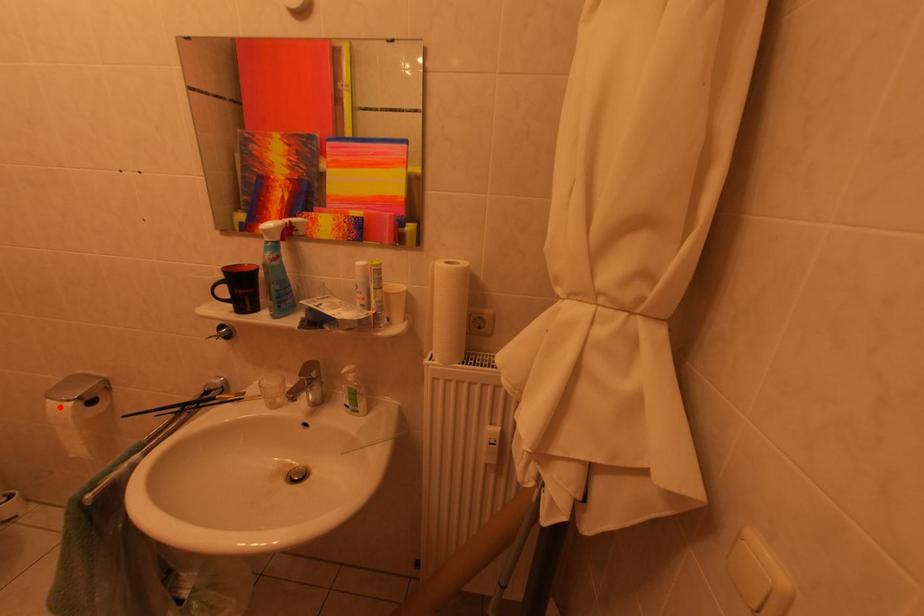
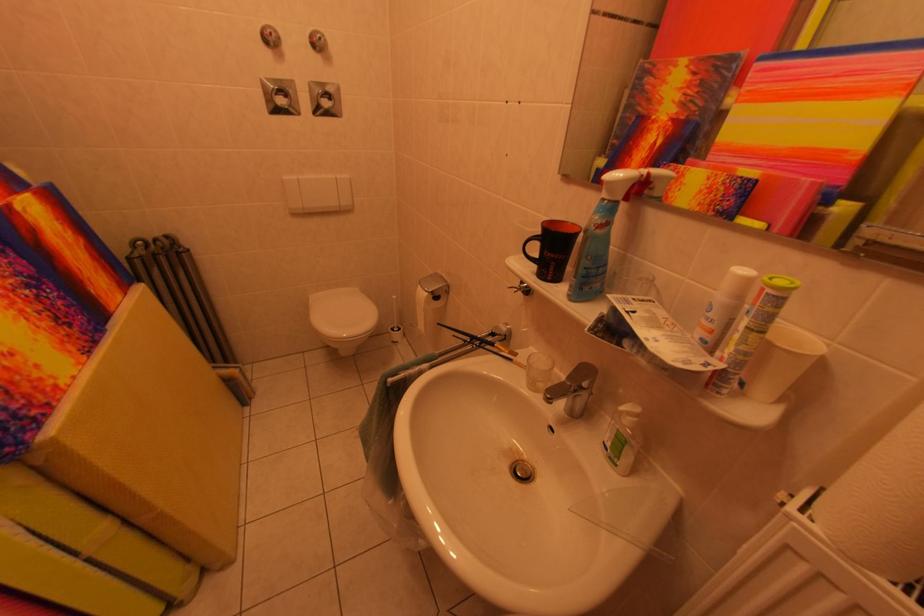
Question: I am providing you with two images of the same scene from different viewpoints. A red point is marked on the first image. Can you still see the location of the red point in image 2?

Choices:
 (A) Yes
 (B) No

Answer: (A)